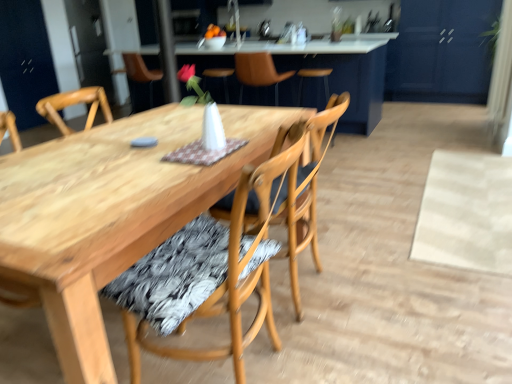
This screenshot has height=384, width=512. Identify the location of wooden chair at center, placed as the 2th chair when sorted from back to front. (298, 190).

This screenshot has width=512, height=384. Describe the element at coordinates (258, 72) in the screenshot. I see `leather at center, acting as the first chair starting from the back` at that location.

This screenshot has height=384, width=512. Identify the location of wooden chair at center, which is the first chair in front-to-back order. (212, 287).

Does point (310, 99) lie in front of point (305, 196)?

That is False.

Which is in front, wooden table at center or wooden chair at center, placed as the 2th chair when sorted from back to front?

wooden chair at center, placed as the 2th chair when sorted from back to front.

Is wooden table at center not near wooden chair at center, placed as the 2th chair when sorted from back to front?

Indeed, wooden table at center is not near wooden chair at center, placed as the 2th chair when sorted from back to front.

Would you say wooden table at center is inside or outside wooden chair at center, placed as the 2th chair when sorted from back to front?

wooden table at center is outside wooden chair at center, placed as the 2th chair when sorted from back to front.

How different are the orientations of leather at center, acting as the first chair starting from the back, and wooden chair at center, positioned as the 3th chair in back-to-front order, in degrees?

96.5 degrees.

Is leather at center, acting as the first chair starting from the back, inside or outside of wooden chair at center, positioned as the 3th chair in back-to-front order?

The correct answer is: outside.

Can you confirm if leather at center, which is the 3th chair in front-to-back order, is taller than wooden chair at center, positioned as the 3th chair in back-to-front order?

No, leather at center, which is the 3th chair in front-to-back order, is not taller than wooden chair at center, positioned as the 3th chair in back-to-front order.

Between wooden chair at center, placed as the 2th chair when sorted from back to front, and leather at center, which is the 3th chair in front-to-back order, which one appears on the left side from the viewer's perspective?

wooden chair at center, placed as the 2th chair when sorted from back to front.

Is wooden chair at center, the 2th chair from the front, turned away from leather at center, which is the 3th chair in front-to-back order?

No, wooden chair at center, the 2th chair from the front,'s orientation is not away from leather at center, which is the 3th chair in front-to-back order.

Is wooden chair at center, the 2th chair from the front, not near leather at center, acting as the first chair starting from the back?

wooden chair at center, the 2th chair from the front, is positioned a significant distance from leather at center, acting as the first chair starting from the back.

Considering the positions of points (306, 228) and (256, 64), is point (306, 228) closer to camera compared to point (256, 64)?

Yes, point (306, 228) is in front of point (256, 64).

Does point (272, 82) appear closer or farther from the camera than point (191, 50)?

Point (272, 82).

Who is shorter, leather at center, which is the 3th chair in front-to-back order, or wooden table at center?

With less height is leather at center, which is the 3th chair in front-to-back order.

Does leather at center, which is the 3th chair in front-to-back order, have a smaller size compared to wooden table at center?

Indeed, leather at center, which is the 3th chair in front-to-back order, has a smaller size compared to wooden table at center.

Is there a large distance between leather at center, which is the 3th chair in front-to-back order, and wooden table at center?

No, leather at center, which is the 3th chair in front-to-back order, is not far from wooden table at center.

From the image's perspective, is wooden table at center under leather at center, which is the 3th chair in front-to-back order?

Actually, wooden table at center appears above leather at center, which is the 3th chair in front-to-back order, in the image.

How many degrees apart are the facing directions of wooden table at center and leather at center, which is the 3th chair in front-to-back order?

There is a 175-degree angle between the facing directions of wooden table at center and leather at center, which is the 3th chair in front-to-back order.

Who is shorter, wooden table at center or leather at center, which is the 3th chair in front-to-back order?

leather at center, which is the 3th chair in front-to-back order, is shorter.

Can you see wooden chair at center, the 2th chair from the front, touching blue matte cabinet at upper right?

No, wooden chair at center, the 2th chair from the front, is not with blue matte cabinet at upper right.

Find the location of a particular element. cabinetry behind the wooden chair at center, the 2th chair from the front is located at coordinates (441, 52).

How far apart are wooden chair at center, placed as the 2th chair when sorted from back to front, and blue matte cabinet at upper right?

A distance of 12.81 feet exists between wooden chair at center, placed as the 2th chair when sorted from back to front, and blue matte cabinet at upper right.

From a real-world perspective, relative to blue matte cabinet at upper right, is wooden chair at center, the 2th chair from the front, vertically above or below?

wooden chair at center, the 2th chair from the front, is below blue matte cabinet at upper right.

In the scene shown: Which is farther, (246, 201) or (471, 86)?

The point (471, 86) is more distant.

Is wooden chair at center, positioned as the 3th chair in back-to-front order, shorter than blue matte cabinet at upper right?

Correct, wooden chair at center, positioned as the 3th chair in back-to-front order, is not as tall as blue matte cabinet at upper right.

Considering the relative sizes of wooden chair at center, positioned as the 3th chair in back-to-front order, and blue matte cabinet at upper right in the image provided, is wooden chair at center, positioned as the 3th chair in back-to-front order, thinner than blue matte cabinet at upper right?

Indeed, wooden chair at center, positioned as the 3th chair in back-to-front order, has a lesser width compared to blue matte cabinet at upper right.

There is a wooden table at center. Where is `the 2nd chair below it (from a real-world perspective)`? The image size is (512, 384). the 2nd chair below it (from a real-world perspective) is located at coordinates (298, 190).

There is a wooden chair at center, positioned as the 3th chair in back-to-front order. Identify the location of chair above it (from a real-world perspective). This screenshot has width=512, height=384. (258, 72).

Which object lies nearer to the anchor point wooden chair at center, which is the first chair in front-to-back order, blue matte cabinet at upper right or wooden chair at center, placed as the 2th chair when sorted from back to front?

wooden chair at center, placed as the 2th chair when sorted from back to front, is closer to wooden chair at center, which is the first chair in front-to-back order.

Looking at the image, which one is located closer to wooden chair at center, which is the first chair in front-to-back order, leather at center, which is the 3th chair in front-to-back order, or blue matte cabinet at upper right?

leather at center, which is the 3th chair in front-to-back order, is closer to wooden chair at center, which is the first chair in front-to-back order.

Which object lies nearer to the anchor point leather at center, acting as the first chair starting from the back, blue matte cabinet at upper right or wooden table at center?

Among the two, wooden table at center is located nearer to leather at center, acting as the first chair starting from the back.

When comparing their distances from wooden chair at center, positioned as the 3th chair in back-to-front order, does wooden table at center or leather at center, acting as the first chair starting from the back, seem closer?

leather at center, acting as the first chair starting from the back, lies closer to wooden chair at center, positioned as the 3th chair in back-to-front order, than the other object.

Which object lies nearer to the anchor point leather at center, acting as the first chair starting from the back, wooden table at center or blue matte cabinet at upper right?

wooden table at center lies closer to leather at center, acting as the first chair starting from the back, than the other object.

When comparing their distances from wooden table at center, does leather at center, acting as the first chair starting from the back, or blue matte cabinet at upper right seem closer?

Among the two, leather at center, acting as the first chair starting from the back, is located nearer to wooden table at center.

Which object lies nearer to the anchor point wooden table at center, wooden chair at center, the 2th chair from the front, or leather at center, acting as the first chair starting from the back?

leather at center, acting as the first chair starting from the back, lies closer to wooden table at center than the other object.

When comparing their distances from wooden chair at center, placed as the 2th chair when sorted from back to front, does wooden chair at center, which is the first chair in front-to-back order, or blue matte cabinet at upper right seem further?

Among the two, blue matte cabinet at upper right is located further to wooden chair at center, placed as the 2th chair when sorted from back to front.

I want to click on chair between wooden chair at center, positioned as the 3th chair in back-to-front order, and leather at center, acting as the first chair starting from the back, along the z-axis, so click(298, 190).

This screenshot has height=384, width=512. What are the coordinates of `table between wooden chair at center, placed as the 2th chair when sorted from back to front, and blue matte cabinet at upper right from front to back` in the screenshot? It's located at (340, 74).

You are a GUI agent. You are given a task and a screenshot of the screen. Output one action in this format:
    pyautogui.click(x=<x>, y=<y>)
    Task: Click on the table positioned between wooden chair at center, which is the first chair in front-to-back order, and blue matte cabinet at upper right from near to far
    The width and height of the screenshot is (512, 384).
    Given the screenshot: What is the action you would take?
    pyautogui.click(x=340, y=74)

This screenshot has width=512, height=384. In order to click on chair between wooden chair at center, the 2th chair from the front, and wooden table at center from front to back in this screenshot , I will do `click(258, 72)`.